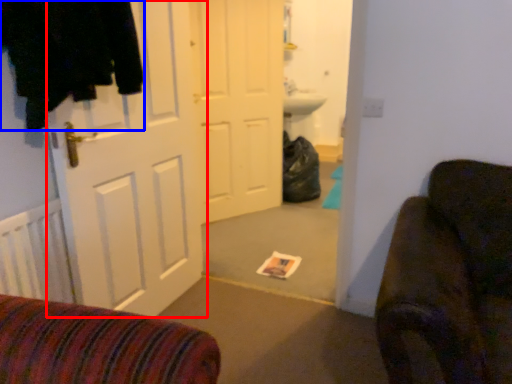
Question: Which of the following is the farthest to the observer, door (highlighted by a red box) or clothing (highlighted by a blue box)?

Choices:
 (A) door
 (B) clothing

Answer: (A)